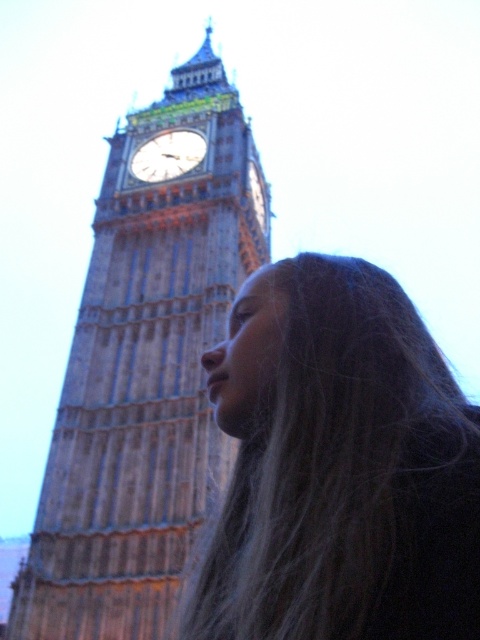
You are a photographer who wants to capture the Elizabeth Tower in the background while ensuring the person with dark brown hair at center is clearly visible. Given their position at coordinates point 0.731, 0.702, where should you position the camera relative to the person to achieve this?

The dark brown hair at center is located at point (336, 467), so positioning the camera slightly behind the person will allow the Elizabeth Tower to be in the background while keeping the person with dark brown hair at center in focus and visible.